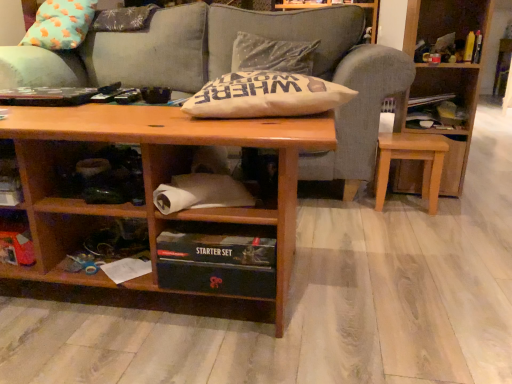
Question: From a real-world perspective, does white cotton pillow at center sit lower than light brown wooden stool at lower right?

Choices:
 (A) yes
 (B) no

Answer: (B)

Question: Can you confirm if white cotton pillow at center is positioned to the left of light brown wooden stool at lower right?

Choices:
 (A) yes
 (B) no

Answer: (A)

Question: Does white cotton pillow at center lie in front of light brown wooden stool at lower right?

Choices:
 (A) no
 (B) yes

Answer: (B)

Question: Is light brown wooden stool at lower right located within white cotton pillow at center?

Choices:
 (A) no
 (B) yes

Answer: (A)

Question: Is light brown wooden stool at lower right at the back of white cotton pillow at center?

Choices:
 (A) yes
 (B) no

Answer: (B)

Question: Can you see white cotton pillow at center touching light brown wooden stool at lower right?

Choices:
 (A) yes
 (B) no

Answer: (B)

Question: From a real-world perspective, is white cotton pillow at center on matte cardboard paper at lower center, the 1th cabinet from the top?

Choices:
 (A) yes
 (B) no

Answer: (A)

Question: Is white cotton pillow at center to the left of matte cardboard paper at lower center, the 1th cabinet from the top, from the viewer's perspective?

Choices:
 (A) yes
 (B) no

Answer: (B)

Question: Can you confirm if white cotton pillow at center is taller than matte cardboard paper at lower center, arranged as the 2th cabinet when ordered from the bottom?

Choices:
 (A) no
 (B) yes

Answer: (B)

Question: From the image's perspective, is white cotton pillow at center on matte cardboard paper at lower center, arranged as the 2th cabinet when ordered from the bottom?

Choices:
 (A) yes
 (B) no

Answer: (A)

Question: Is white cotton pillow at center positioned with its back to matte cardboard paper at lower center, the 1th cabinet from the top?

Choices:
 (A) yes
 (B) no

Answer: (B)

Question: Is the position of white cotton pillow at center less distant than that of matte cardboard paper at lower center, arranged as the 2th cabinet when ordered from the bottom?

Choices:
 (A) no
 (B) yes

Answer: (A)

Question: Is wooden box at lower left positioned behind black cardboard box at lower center, arranged as the 1th cabinet when ordered from the bottom?

Choices:
 (A) yes
 (B) no

Answer: (A)